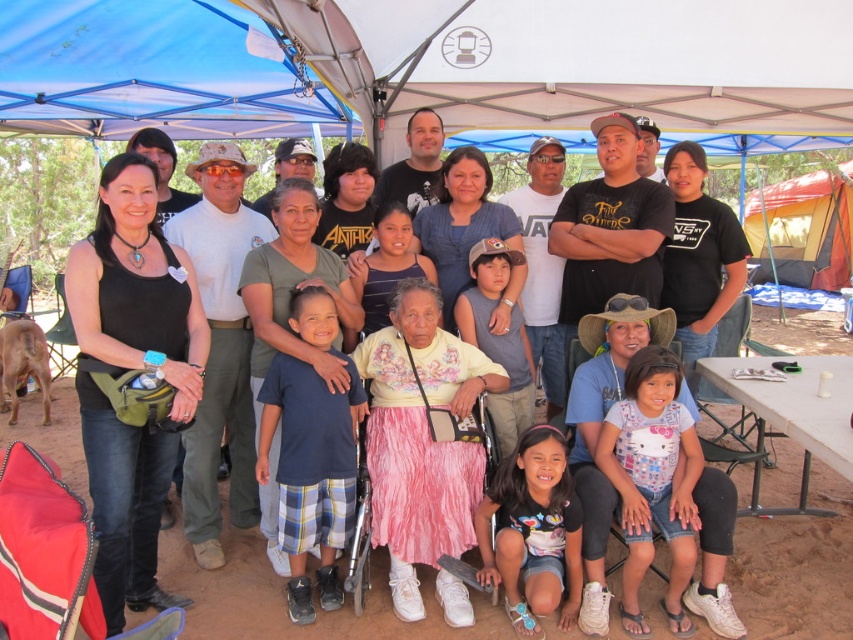
Looking at the scene, where is the matte black tank top at left in relation to the yellow canvas tent at upper right?

The matte black tank top at left is to the left of the yellow canvas tent at upper right.

You are a photographer setting up for a group photo at an outdoor event. You need to position the group so they are under the shade of the blue fabric canopy at upper left and the yellow canvas tent at upper right. Which structure should you place the group closer to if you want them to be shaded by both but not directly under either one?

The group should be positioned between the blue fabric canopy at upper left and the yellow canvas tent at upper right since the blue fabric canopy at upper left is to the left of the yellow canvas tent at upper right, allowing them to be shaded by both without being directly under either structure.